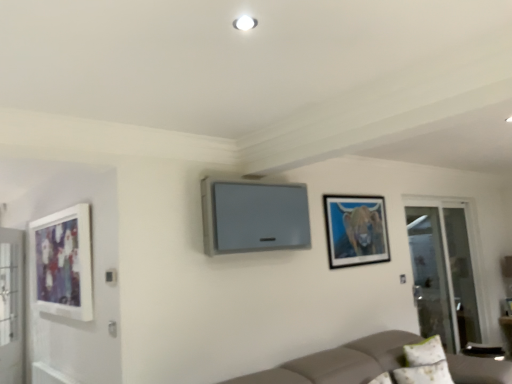
This screenshot has height=384, width=512. Find the location of `free space above matte black picture frame at upper right, which is the second picture frame in left-to-right order (from a real-world perspective)`. free space above matte black picture frame at upper right, which is the second picture frame in left-to-right order (from a real-world perspective) is located at coordinates (354, 194).